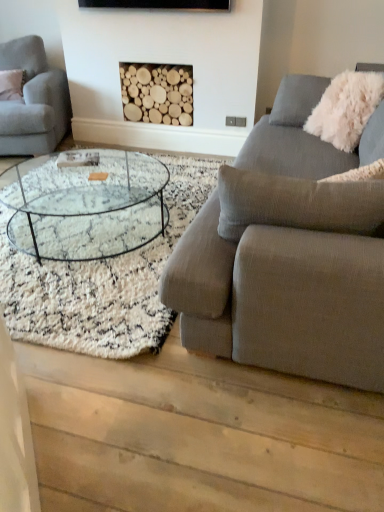
I want to click on vacant space in clear glass coffee table at center (from a real-world perspective), so click(x=94, y=238).